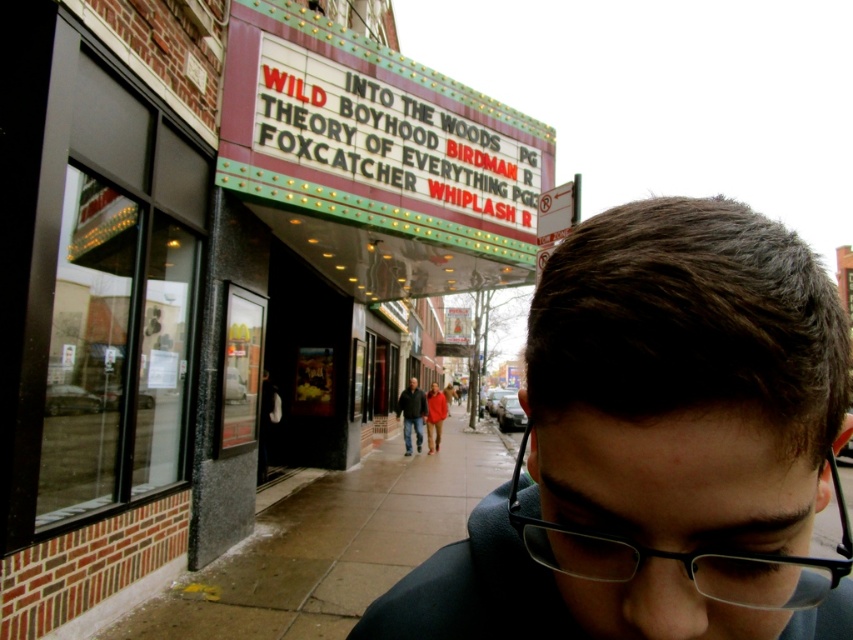
Question: Which point appears farthest from the camera in this image?

Choices:
 (A) (410, 388)
 (B) (787, 285)
 (C) (56, 115)

Answer: (A)

Question: Is brick facade at center closer to camera compared to wet concrete sidewalk at lower center?

Choices:
 (A) yes
 (B) no

Answer: (B)

Question: Which object is farther from the camera taking this photo?

Choices:
 (A) brick facade at center
 (B) dark brown hair at center
 (C) black plastic glasses at center

Answer: (A)

Question: Is dark brown hair at center thinner than dark gray jacket at center?

Choices:
 (A) yes
 (B) no

Answer: (B)

Question: Is dark brown hair at center bigger than black plastic glasses at center?

Choices:
 (A) no
 (B) yes

Answer: (A)

Question: Which point appears closest to the camera in this image?

Choices:
 (A) click(811, 589)
 (B) click(712, 202)
 (C) click(421, 406)
 (D) click(224, 51)

Answer: (B)